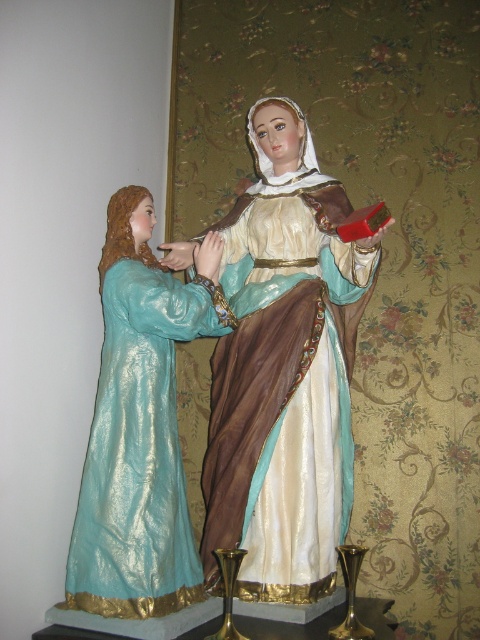
Question: Can you confirm if silky brown dress at center is thinner than shiny teal dress at left?

Choices:
 (A) yes
 (B) no

Answer: (B)

Question: Which of the following is the closest to the observer?

Choices:
 (A) silky brown dress at center
 (B) shiny teal dress at left

Answer: (B)

Question: Does silky brown dress at center appear on the left side of shiny teal dress at left?

Choices:
 (A) yes
 (B) no

Answer: (B)

Question: Is silky brown dress at center thinner than shiny teal dress at left?

Choices:
 (A) no
 (B) yes

Answer: (A)

Question: Which point is closer to the camera taking this photo?

Choices:
 (A) (69, 550)
 (B) (249, 316)

Answer: (A)

Question: Which point is farther from the camera taking this photo?

Choices:
 (A) (292, 380)
 (B) (177, 438)

Answer: (A)